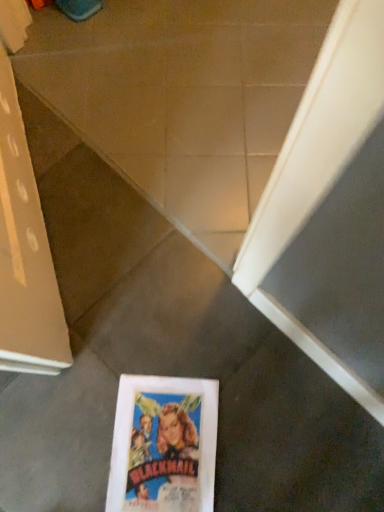
In order to face multicolored paper at center, should I rotate leftwards or rightwards?

Turn left by 4.420 degrees to look at multicolored paper at center.

What do you see at coordinates (164, 445) in the screenshot? I see `multicolored paper at center` at bounding box center [164, 445].

What is the approximate height of multicolored paper at center?

1.90 centimeters.

Identify the location of multicolored paper at center. (164, 445).

The height and width of the screenshot is (512, 384). Describe the element at coordinates (182, 98) in the screenshot. I see `white glossy concrete at center` at that location.

Identify the location of white glossy concrete at center. This screenshot has height=512, width=384. (182, 98).

Where is `multicolored paper at center`? multicolored paper at center is located at coordinates (164, 445).

Considering the positions of objects white glossy concrete at center and multicolored paper at center in the image provided, who is more to the left, white glossy concrete at center or multicolored paper at center?

Positioned to the left is multicolored paper at center.

Is white glossy concrete at center positioned in front of multicolored paper at center?

That is False.

Between point (170, 184) and point (216, 436), which one is positioned in front?

The point (216, 436) is more forward.

From the image's perspective, is white glossy concrete at center above or below multicolored paper at center?

From the image's perspective, white glossy concrete at center appears above multicolored paper at center.

From a real-world perspective, is white glossy concrete at center over multicolored paper at center?

No, from a real-world perspective, white glossy concrete at center is not on top of multicolored paper at center.

Which of these two, white glossy concrete at center or multicolored paper at center, is wider?

white glossy concrete at center.

Does white glossy concrete at center have a lesser height compared to multicolored paper at center?

No.

Which of these two, white glossy concrete at center or multicolored paper at center, is bigger?

white glossy concrete at center is bigger.

Based on the photo, does white glossy concrete at center contain multicolored paper at center?

No, white glossy concrete at center does not contain multicolored paper at center.

Is white glossy concrete at center placed right next to multicolored paper at center?

white glossy concrete at center and multicolored paper at center are clearly separated.

Could you tell me if white glossy concrete at center is turned towards multicolored paper at center?

Yes, white glossy concrete at center is turned towards multicolored paper at center.

You are a GUI agent. You are given a task and a screenshot of the screen. Output one action in this format:
    pyautogui.click(x=<x>, y=<y>)
    Task: Click on the concrete located above the multicolored paper at center (from the image's perspective)
    Image resolution: width=384 pixels, height=512 pixels.
    Given the screenshot: What is the action you would take?
    pyautogui.click(x=182, y=98)

Does multicolored paper at center appear on the right side of white glossy concrete at center?

Incorrect, multicolored paper at center is not on the right side of white glossy concrete at center.

Is the position of multicolored paper at center more distant than that of white glossy concrete at center?

No, the depth of multicolored paper at center is less than that of white glossy concrete at center.

Is point (215, 388) positioned before point (144, 2)?

Yes.

From the image's perspective, would you say multicolored paper at center is shown under white glossy concrete at center?

Yes.

From a real-world perspective, which object rests below the other?

From a 3D spatial view, white glossy concrete at center is below.

Is multicolored paper at center wider than white glossy concrete at center?

In fact, multicolored paper at center might be narrower than white glossy concrete at center.

Which of these two, multicolored paper at center or white glossy concrete at center, stands taller?

white glossy concrete at center is taller.

Considering the sizes of multicolored paper at center and white glossy concrete at center in the image, is multicolored paper at center bigger or smaller than white glossy concrete at center?

In the image, multicolored paper at center appears to be smaller than white glossy concrete at center.

Is white glossy concrete at center located within multicolored paper at center?

Actually, white glossy concrete at center is outside multicolored paper at center.

Is the surface of multicolored paper at center in direct contact with white glossy concrete at center?

No, multicolored paper at center is not making contact with white glossy concrete at center.

Is multicolored paper at center turned away from white glossy concrete at center?

multicolored paper at center does not have its back to white glossy concrete at center.

Find the location of a particular element. paperback book that is on the left side of white glossy concrete at center is located at coordinates click(164, 445).

Identify the location of paperback book that is below the white glossy concrete at center (from the image's perspective). (164, 445).

Image resolution: width=384 pixels, height=512 pixels. I want to click on concrete that appears above the multicolored paper at center (from the image's perspective), so click(x=182, y=98).